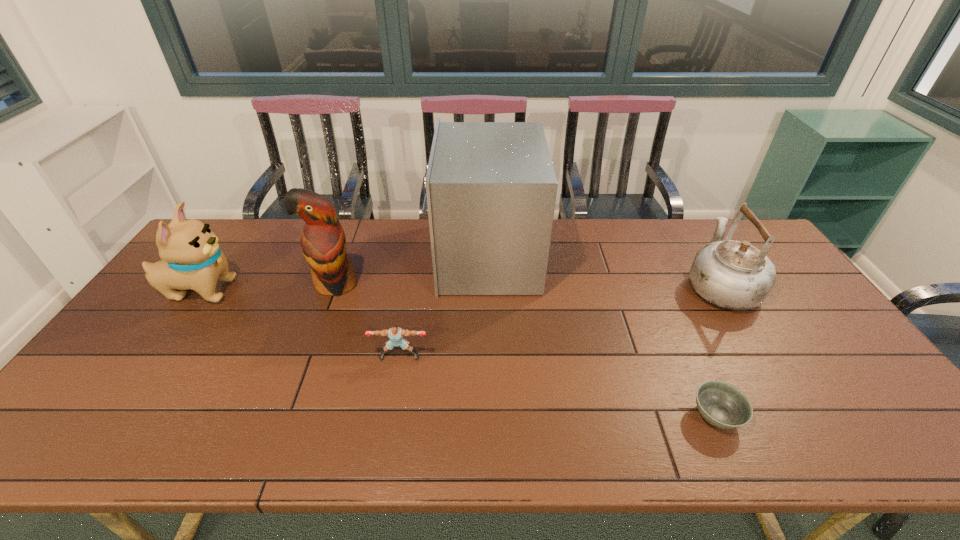
Find the location of `vacant region that satisfies the following two spatial constraints: 1. at the spout of the rightmost object; 2. on the front panel of the toaster oven`. vacant region that satisfies the following two spatial constraints: 1. at the spout of the rightmost object; 2. on the front panel of the toaster oven is located at coordinates (703, 257).

Locate an element on the screen. The height and width of the screenshot is (540, 960). free space that satisfies the following two spatial constraints: 1. at the spout of the kettle; 2. on the front panel of the toaster oven is located at coordinates (703, 257).

The width and height of the screenshot is (960, 540). I want to click on blank area in the image that satisfies the following two spatial constraints: 1. on the front panel of the bowl; 2. on the right side of the toaster oven, so click(488, 416).

Where is `free location that satisfies the following two spatial constraints: 1. on the face of the puppy; 2. on the back side of the second object from right to left`? The image size is (960, 540). free location that satisfies the following two spatial constraints: 1. on the face of the puppy; 2. on the back side of the second object from right to left is located at coordinates (110, 416).

In order to click on vacant region that satisfies the following two spatial constraints: 1. on the front panel of the toaster oven; 2. at the spout of the kettle in this screenshot , I will do `click(486, 285)`.

Identify the location of vacant space that satisfies the following two spatial constraints: 1. on the front panel of the toaster oven; 2. on the face of the second object from left to right. (486, 284).